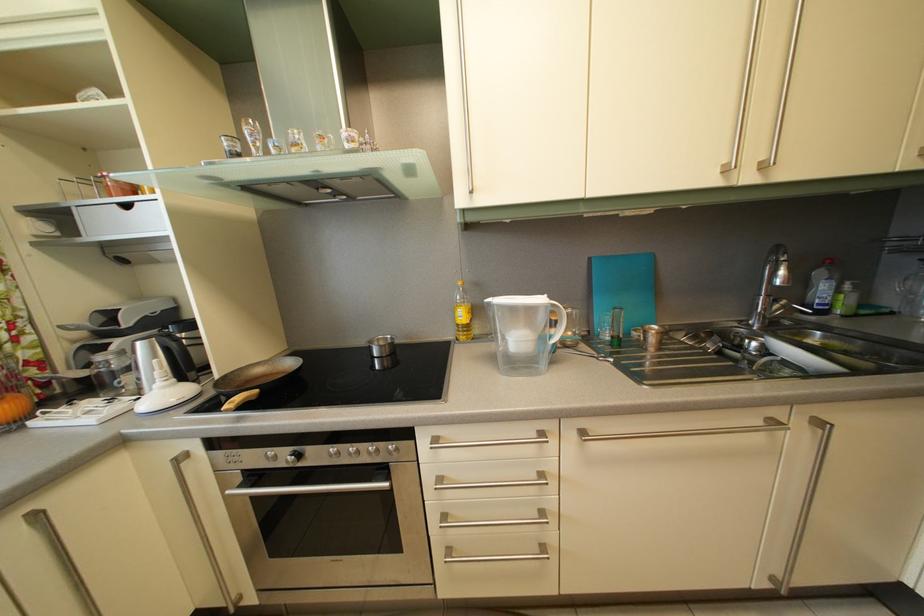
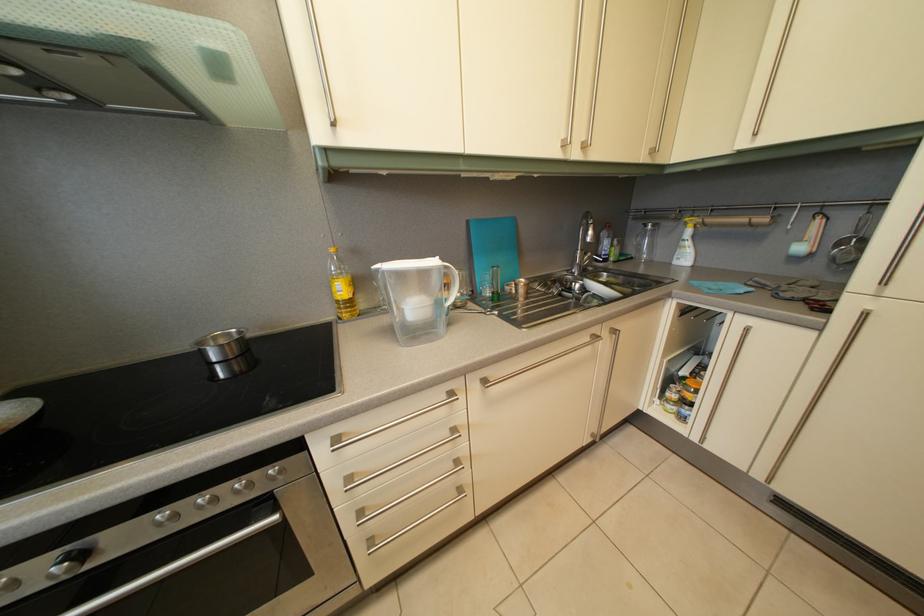
In the second image, find the point that corresponds to (526,347) in the first image.

(421, 315)